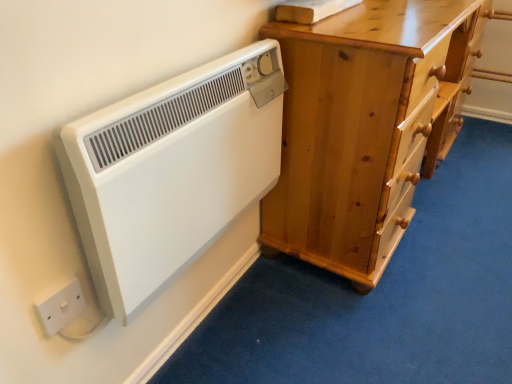
Question: Is light brown wooden chest of drawers at right far away from white plastic radiator at left?

Choices:
 (A) no
 (B) yes

Answer: (A)

Question: Considering the relative positions of light brown wooden chest of drawers at right and white plastic radiator at left in the image provided, is light brown wooden chest of drawers at right to the left of white plastic radiator at left from the viewer's perspective?

Choices:
 (A) yes
 (B) no

Answer: (B)

Question: Can you confirm if light brown wooden chest of drawers at right is wider than white plastic radiator at left?

Choices:
 (A) no
 (B) yes

Answer: (B)

Question: Considering the relative positions of light brown wooden chest of drawers at right and white plastic radiator at left in the image provided, is light brown wooden chest of drawers at right behind white plastic radiator at left?

Choices:
 (A) yes
 (B) no

Answer: (A)

Question: Is light brown wooden chest of drawers at right closer to camera compared to white plastic radiator at left?

Choices:
 (A) no
 (B) yes

Answer: (A)

Question: Considering the relative positions of light brown wooden chest of drawers at right and white plastic radiator at left in the image provided, is light brown wooden chest of drawers at right to the right of white plastic radiator at left from the viewer's perspective?

Choices:
 (A) no
 (B) yes

Answer: (B)

Question: From a real-world perspective, is white plastic radiator at left located higher than white plastic electric outlet at lower left?

Choices:
 (A) yes
 (B) no

Answer: (A)

Question: Is white plastic radiator at left not within white plastic electric outlet at lower left?

Choices:
 (A) yes
 (B) no

Answer: (A)

Question: Considering the relative positions of white plastic radiator at left and white plastic electric outlet at lower left in the image provided, is white plastic radiator at left behind white plastic electric outlet at lower left?

Choices:
 (A) no
 (B) yes

Answer: (A)

Question: Is white plastic radiator at left at the right side of white plastic electric outlet at lower left?

Choices:
 (A) yes
 (B) no

Answer: (A)

Question: Does white plastic radiator at left touch white plastic electric outlet at lower left?

Choices:
 (A) yes
 (B) no

Answer: (B)

Question: From the image's perspective, does white plastic radiator at left appear higher than white plastic electric outlet at lower left?

Choices:
 (A) yes
 (B) no

Answer: (A)

Question: From the image's perspective, would you say white plastic electric outlet at lower left is positioned over white plastic radiator at left?

Choices:
 (A) yes
 (B) no

Answer: (B)